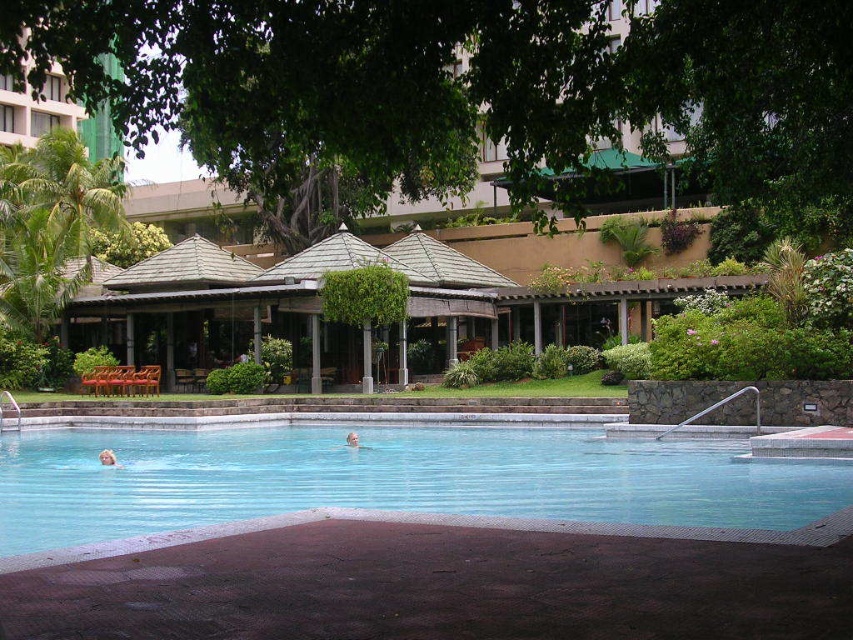
Is clear blue water at center taller than light brown skin at lower center?

Yes, clear blue water at center is taller than light brown skin at lower center.

Does clear blue water at center appear over light brown skin at lower center?

Yes, clear blue water at center is above light brown skin at lower center.

The width and height of the screenshot is (853, 640). What do you see at coordinates (392, 477) in the screenshot?
I see `clear blue water at center` at bounding box center [392, 477].

The width and height of the screenshot is (853, 640). I want to click on clear blue water at center, so click(x=392, y=477).

Which is behind, point (714, 528) or point (349, 438)?

Point (349, 438)

Is the position of clear blue water at center more distant than that of light brown skin at center?

No, clear blue water at center is closer to the viewer.

Describe the element at coordinates (392, 477) in the screenshot. I see `clear blue water at center` at that location.

Where is `clear blue water at center`? clear blue water at center is located at coordinates (392, 477).

Can you confirm if light brown skin at lower center is smaller than light brown skin at center?

No.

Which is behind, point (111, 460) or point (350, 445)?

The point (350, 445) is more distant.

This screenshot has width=853, height=640. I want to click on light brown skin at lower center, so click(x=107, y=458).